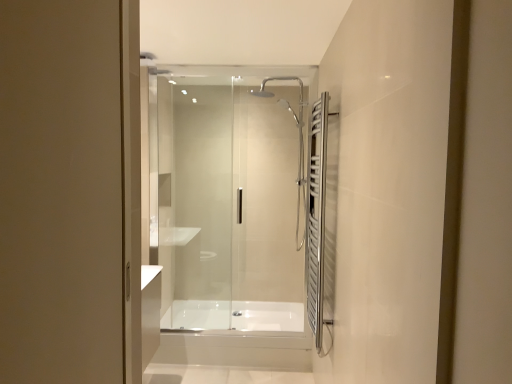
The height and width of the screenshot is (384, 512). What do you see at coordinates (316, 215) in the screenshot? I see `satin nickel towel rack at right` at bounding box center [316, 215].

Image resolution: width=512 pixels, height=384 pixels. What are the coordinates of `white glossy bathtub at center` in the screenshot? It's located at (234, 315).

Is transparent glass shower door at center positioned with its back to white glossy bathtub at center?

Yes, transparent glass shower door at center is facing away from white glossy bathtub at center.

Image resolution: width=512 pixels, height=384 pixels. In order to click on glass door located above the white glossy bathtub at center (from a real-world perspective) in this screenshot , I will do `click(232, 197)`.

From a real-world perspective, relative to white glossy bathtub at center, is transparent glass shower door at center vertically above or below?

Clearly, from a real-world perspective, transparent glass shower door at center is above white glossy bathtub at center.

This screenshot has height=384, width=512. I want to click on bath on the left side of satin nickel towel rack at right, so click(234, 315).

From the picture: Considering the sizes of objects satin nickel towel rack at right and white glossy bathtub at center in the image provided, who is thinner, satin nickel towel rack at right or white glossy bathtub at center?

With smaller width is satin nickel towel rack at right.

Is satin nickel towel rack at right aimed at white glossy bathtub at center?

No, satin nickel towel rack at right is not turned towards white glossy bathtub at center.

Between satin nickel towel rack at right and white glossy bathtub at center, which one is positioned in front?

satin nickel towel rack at right is in front.

Does white glossy bathtub at center come in front of transparent glass shower door at center?

No, it is behind transparent glass shower door at center.

Considering the sizes of white glossy bathtub at center and transparent glass shower door at center in the image, is white glossy bathtub at center wider or thinner than transparent glass shower door at center?

In the image, white glossy bathtub at center appears to be wider than transparent glass shower door at center.

Based on their positions, is white glossy bathtub at center located to the left or right of transparent glass shower door at center?

From the image, it's evident that white glossy bathtub at center is to the right of transparent glass shower door at center.

Is the depth of transparent glass shower door at center greater than that of satin nickel towel rack at right?

Yes, transparent glass shower door at center is further from the viewer.

In the scene shown: Considering the sizes of objects transparent glass shower door at center and satin nickel towel rack at right in the image provided, who is taller, transparent glass shower door at center or satin nickel towel rack at right?

transparent glass shower door at center.

Is white glossy bathtub at center shorter than satin nickel towel rack at right?

Yes.

Considering the relative sizes of white glossy bathtub at center and satin nickel towel rack at right in the image provided, is white glossy bathtub at center wider than satin nickel towel rack at right?

Yes.

Can you confirm if white glossy bathtub at center is positioned to the right of satin nickel towel rack at right?

No, white glossy bathtub at center is not to the right of satin nickel towel rack at right.

From the image's perspective, which object appears higher, white glossy bathtub at center or satin nickel towel rack at right?

satin nickel towel rack at right is shown above in the image.

What's the angular difference between satin nickel towel rack at right and transparent glass shower door at center's facing directions?

The angle between the facing direction of satin nickel towel rack at right and the facing direction of transparent glass shower door at center is 90.4 degrees.

Considering the points (325, 179) and (221, 309), which point is behind, point (325, 179) or point (221, 309)?

Point (221, 309)

I want to click on shower curtain in front of the transparent glass shower door at center, so click(x=316, y=215).

Is satin nickel towel rack at right outside of transparent glass shower door at center?

That's correct, satin nickel towel rack at right is outside of transparent glass shower door at center.

The height and width of the screenshot is (384, 512). I want to click on glass door that is in front of the white glossy bathtub at center, so click(x=232, y=197).

Where is `shower curtain above the white glossy bathtub at center (from a real-world perspective)`? The width and height of the screenshot is (512, 384). shower curtain above the white glossy bathtub at center (from a real-world perspective) is located at coordinates (316, 215).

Based on their spatial positions, is white glossy bathtub at center or transparent glass shower door at center further from satin nickel towel rack at right?

Based on the image, white glossy bathtub at center appears to be further to satin nickel towel rack at right.

Considering their positions, is satin nickel towel rack at right positioned further to white glossy bathtub at center than transparent glass shower door at center?

satin nickel towel rack at right is positioned further to the anchor white glossy bathtub at center.

Based on their spatial positions, is transparent glass shower door at center or white glossy bathtub at center closer to satin nickel towel rack at right?

The object closer to satin nickel towel rack at right is transparent glass shower door at center.

Looking at the image, which one is located further to white glossy bathtub at center, transparent glass shower door at center or satin nickel towel rack at right?

satin nickel towel rack at right is positioned further to the anchor white glossy bathtub at center.

Which object lies further to the anchor point transparent glass shower door at center, satin nickel towel rack at right or white glossy bathtub at center?

Among the two, satin nickel towel rack at right is located further to transparent glass shower door at center.

Estimate the real-world distances between objects in this image. Which object is further from transparent glass shower door at center, white glossy bathtub at center or satin nickel towel rack at right?

The object further to transparent glass shower door at center is satin nickel towel rack at right.

Locate an element on the screen. The width and height of the screenshot is (512, 384). glass door located between satin nickel towel rack at right and white glossy bathtub at center in the depth direction is located at coordinates (232, 197).